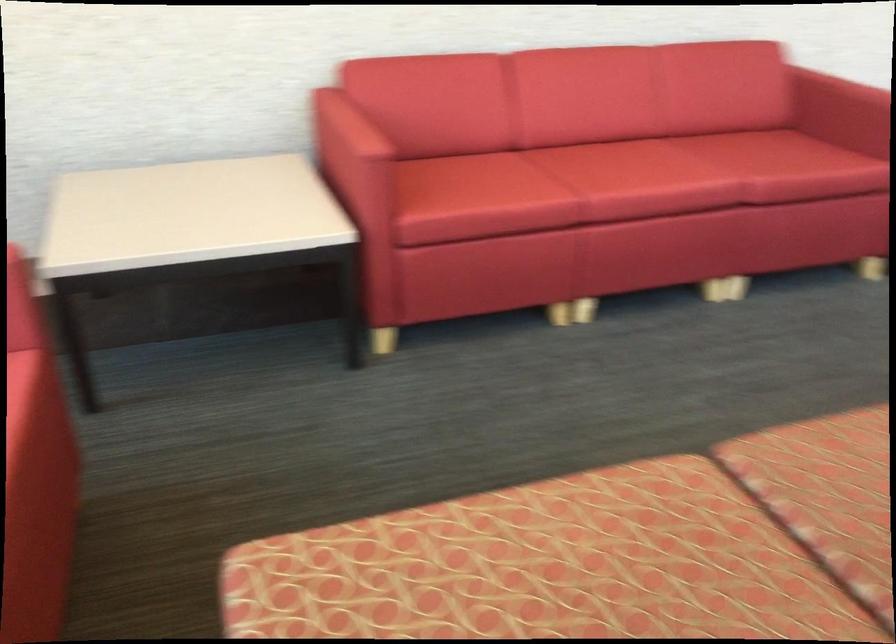
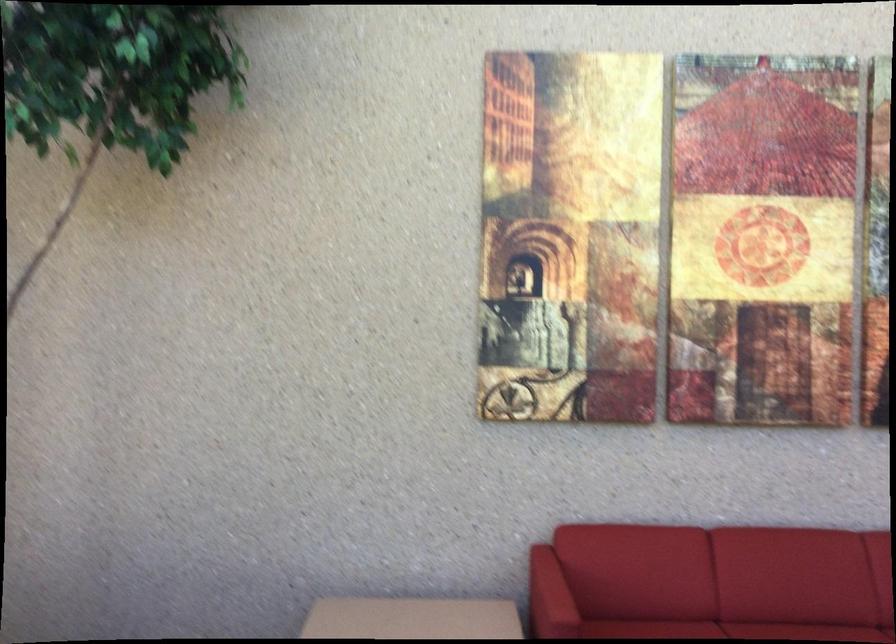
In the second image, find the point that corresponds to pixel 363 140 in the first image.

(549, 597)